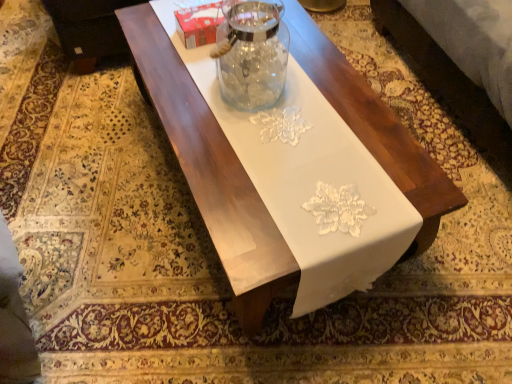
Locate an element on the screen. The height and width of the screenshot is (384, 512). free point in front of transparent glass jar at center is located at coordinates (251, 144).